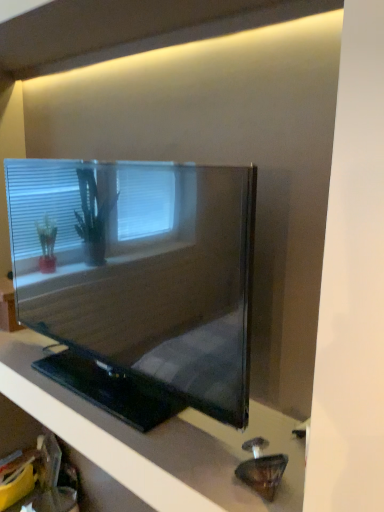
The width and height of the screenshot is (384, 512). I want to click on vacant area situated below matte black tv at center (from a real-world perspective), so click(x=113, y=398).